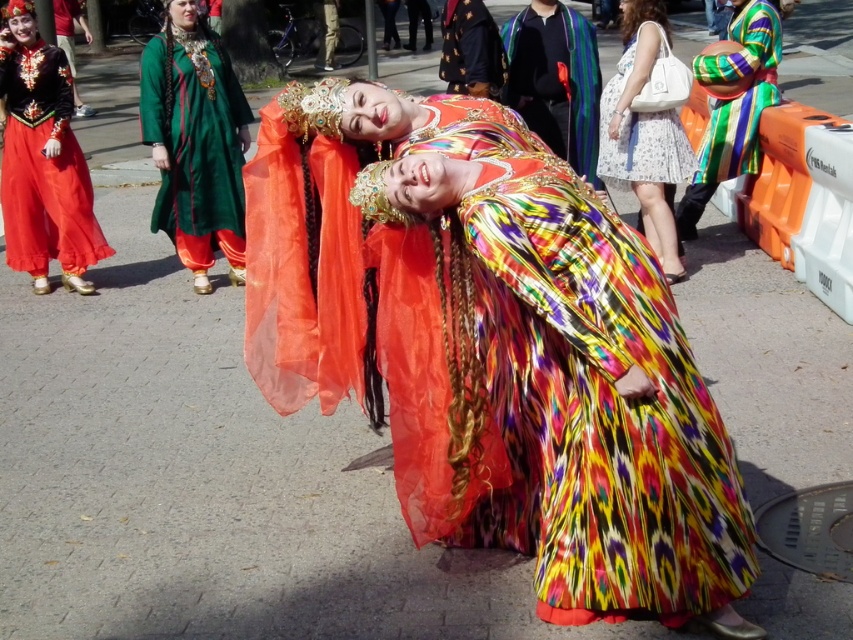
Based on the coordinates provided, where is the multicolored silk dress at center located in the image?

The multicolored silk dress at center is located at the coordinates point [534,364].

You are standing at the point with coordinates point [544,51] and want to walk to the point with coordinates point [79,177]. Which direction should you move in relation to the two women in the scene?

Point [79,177] is behind point [544,51]. So you should move backward away from the two women in the scene to reach point [79,177].